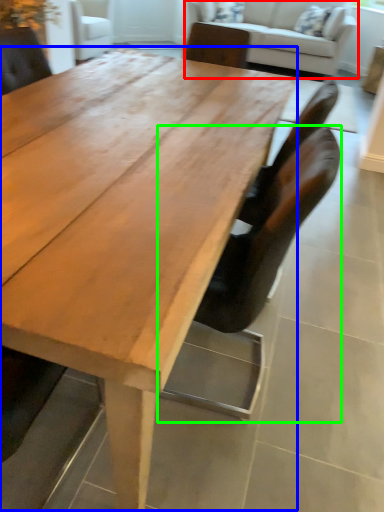
Question: Considering the real-world distances, which object is closest to studio couch (highlighted by a red box)? coffee table (highlighted by a blue box) or chair (highlighted by a green box).

Choices:
 (A) coffee table
 (B) chair

Answer: (A)